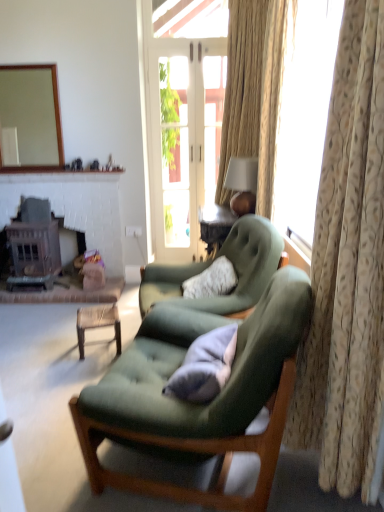
Question: Is beige floral fabric curtain at right, which is counted as the second curtain, starting from the back, a part of soft gray cushion at center?

Choices:
 (A) yes
 (B) no

Answer: (B)

Question: Is soft gray cushion at center beside beige floral fabric curtain at right, positioned as the 1th curtain in front-to-back order?

Choices:
 (A) no
 (B) yes

Answer: (A)

Question: Does soft gray cushion at center have a greater height compared to beige floral fabric curtain at right, which is counted as the second curtain, starting from the back?

Choices:
 (A) yes
 (B) no

Answer: (B)

Question: From a real-world perspective, is soft gray cushion at center on beige floral fabric curtain at right, positioned as the 1th curtain in front-to-back order?

Choices:
 (A) no
 (B) yes

Answer: (A)

Question: From the image's perspective, does soft gray cushion at center appear lower than beige floral fabric curtain at right, which is counted as the second curtain, starting from the back?

Choices:
 (A) yes
 (B) no

Answer: (A)

Question: Considering the relative sizes of soft gray cushion at center and beige floral fabric curtain at right, positioned as the 1th curtain in front-to-back order, in the image provided, is soft gray cushion at center smaller than beige floral fabric curtain at right, positioned as the 1th curtain in front-to-back order,?

Choices:
 (A) no
 (B) yes

Answer: (B)

Question: Is light beige textured curtain at right, marked as the second curtain in a front-to-back arrangement, smaller than beige floral fabric curtain at right, positioned as the 1th curtain in front-to-back order?

Choices:
 (A) yes
 (B) no

Answer: (B)

Question: Is light beige textured curtain at right, marked as the second curtain in a front-to-back arrangement, turned away from beige floral fabric curtain at right, positioned as the 1th curtain in front-to-back order?

Choices:
 (A) yes
 (B) no

Answer: (B)

Question: From a real-world perspective, is light beige textured curtain at right, which is counted as the first curtain, starting from the back, below beige floral fabric curtain at right, positioned as the 1th curtain in front-to-back order?

Choices:
 (A) yes
 (B) no

Answer: (B)

Question: Is light beige textured curtain at right, which is counted as the first curtain, starting from the back, wider than beige floral fabric curtain at right, positioned as the 1th curtain in front-to-back order?

Choices:
 (A) no
 (B) yes

Answer: (B)

Question: From the image's perspective, is light beige textured curtain at right, which is counted as the first curtain, starting from the back, located beneath beige floral fabric curtain at right, which is counted as the second curtain, starting from the back?

Choices:
 (A) yes
 (B) no

Answer: (B)

Question: From the image's perspective, is light beige textured curtain at right, which is counted as the first curtain, starting from the back, on top of beige floral fabric curtain at right, positioned as the 1th curtain in front-to-back order?

Choices:
 (A) yes
 (B) no

Answer: (A)

Question: From the image's perspective, does velvet green armchair at center, arranged as the 2th chair when viewed from the front, appear higher than soft gray cushion at center?

Choices:
 (A) no
 (B) yes

Answer: (B)